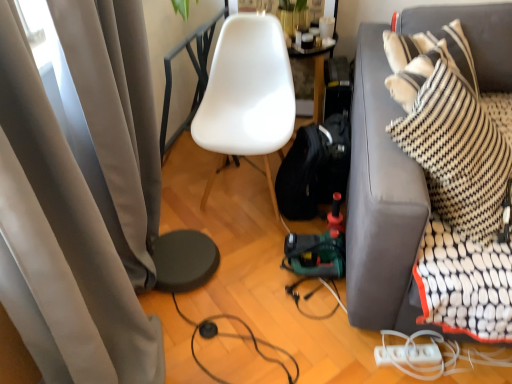
Question: Which is correct: white matte chair at center is inside black rubber cable at lower center, the second cable viewed from the right, or outside of it?

Choices:
 (A) inside
 (B) outside

Answer: (B)

Question: Relative to black rubber cable at lower center, marked as the 1th cable in a left-to-right arrangement, is white matte chair at center in front or behind?

Choices:
 (A) behind
 (B) front

Answer: (A)

Question: Which object is the farthest from the black rubber cable at lower center, marked as the 1th cable in a left-to-right arrangement?

Choices:
 (A) dark gray fabric couch at right
 (B) white matte chair at center
 (C) matte gray curtain at left
 (D) white plastic extension cord at lower right
 (E) white plastic power strip at lower right, which is counted as the 1th cable, starting from the right

Answer: (B)

Question: Which object is the farthest from the black rubber cable at lower center, marked as the 1th cable in a left-to-right arrangement?

Choices:
 (A) dark gray fabric couch at right
 (B) white matte chair at center
 (C) white plastic power strip at lower right, which is counted as the 1th cable, starting from the right
 (D) white plastic extension cord at lower right
 (E) matte gray curtain at left

Answer: (B)